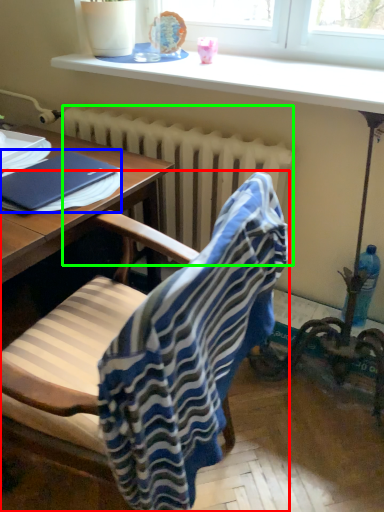
Question: Considering the real-world distances, which object is closest to chair (highlighted by a red box)? notebook (highlighted by a blue box) or radiator (highlighted by a green box).

Choices:
 (A) notebook
 (B) radiator

Answer: (A)